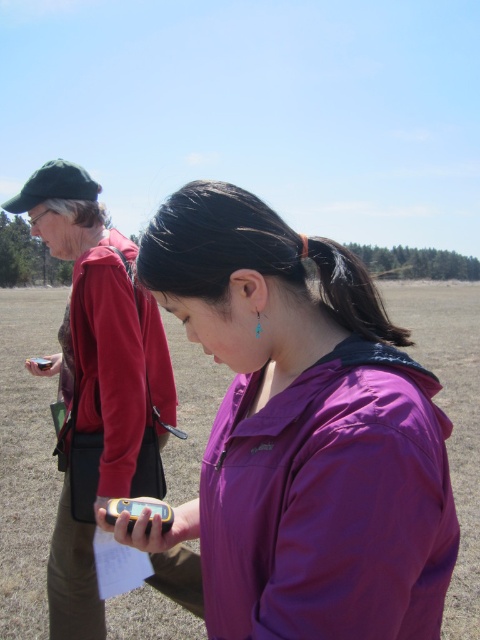
Question: Does purple fabric jacket at center come in front of matte red jacket at center?

Choices:
 (A) no
 (B) yes

Answer: (B)

Question: Is purple fabric jacket at center to the left of matte red jacket at center from the viewer's perspective?

Choices:
 (A) yes
 (B) no

Answer: (B)

Question: Which object is the closest to the matte black gps at left?

Choices:
 (A) black silky hair at upper center
 (B) purple fabric jacket at center

Answer: (B)

Question: Which of these objects is positioned farthest from the purple fabric jacket at center?

Choices:
 (A) matte red jacket at center
 (B) black silky hair at upper center
 (C) matte black gps at left

Answer: (C)

Question: Is the position of purple fabric jacket at center more distant than that of black silky hair at upper center?

Choices:
 (A) yes
 (B) no

Answer: (B)

Question: Which of the following is the farthest from the observer?

Choices:
 (A) black silky hair at upper center
 (B) matte red jacket at center
 (C) matte black gps at left

Answer: (B)